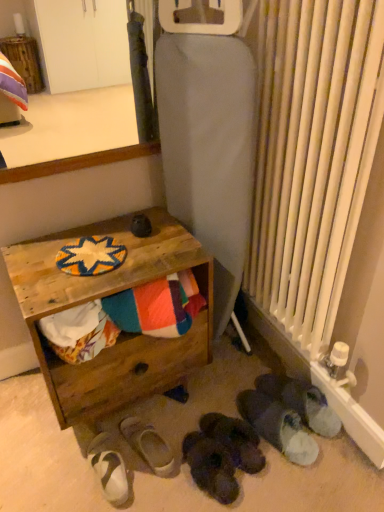
Find the location of a particular element. The image size is (384, 512). vacant space that is in between white fabric slipper at lower center, the 2th footwear in the left-to-right sequence, and dark gray suede slippers at lower center, the 4th footwear viewed from the right is located at coordinates (177, 472).